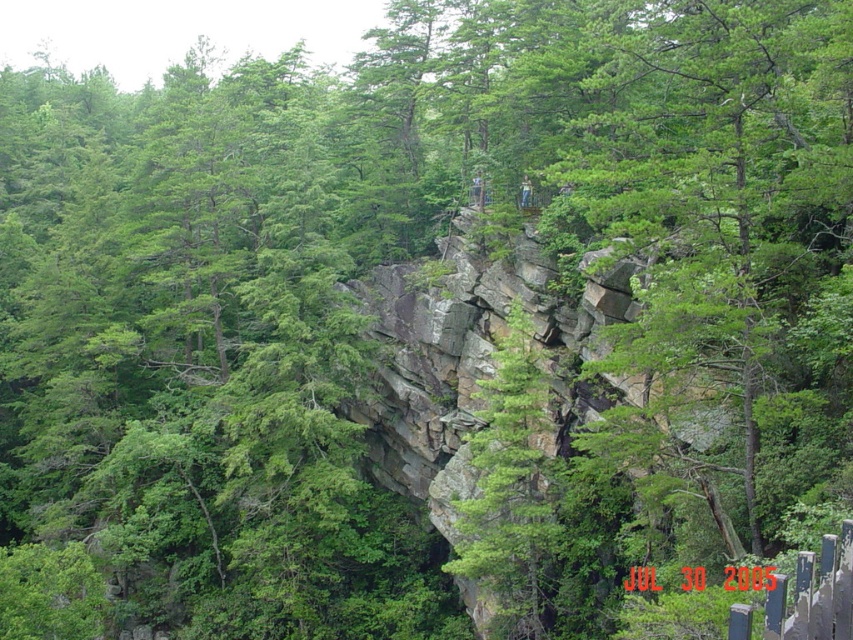
Does point (817, 381) come behind point (538, 572)?

No, it is not.

You are a GUI agent. You are given a task and a screenshot of the screen. Output one action in this format:
    pyautogui.click(x=<x>, y=<y>)
    Task: Click on the green matte tree at center
    
    Given the screenshot: What is the action you would take?
    pyautogui.click(x=728, y=241)

The height and width of the screenshot is (640, 853). What do you see at coordinates (728, 241) in the screenshot?
I see `green matte tree at center` at bounding box center [728, 241].

The image size is (853, 640). What are the coordinates of `green matte tree at center` in the screenshot? It's located at (728, 241).